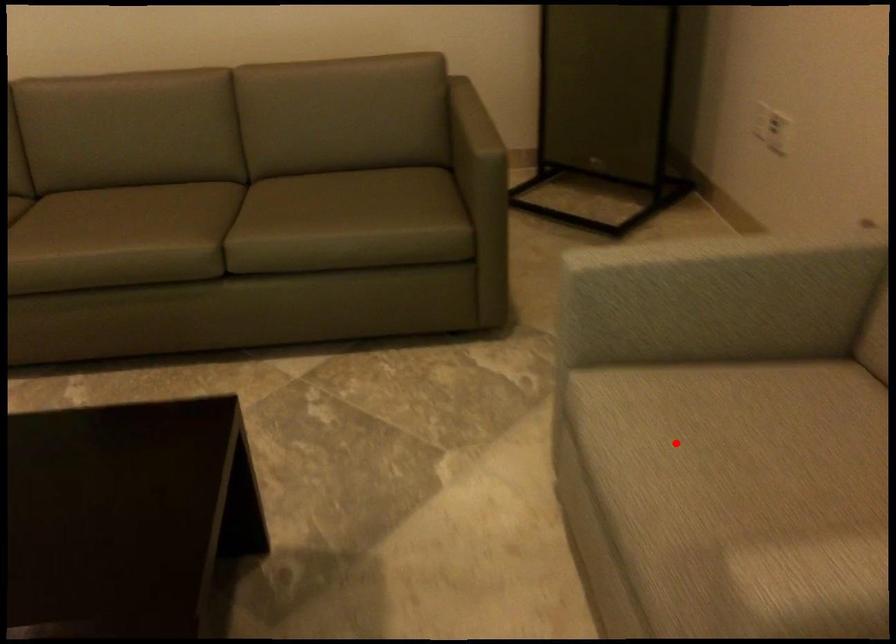
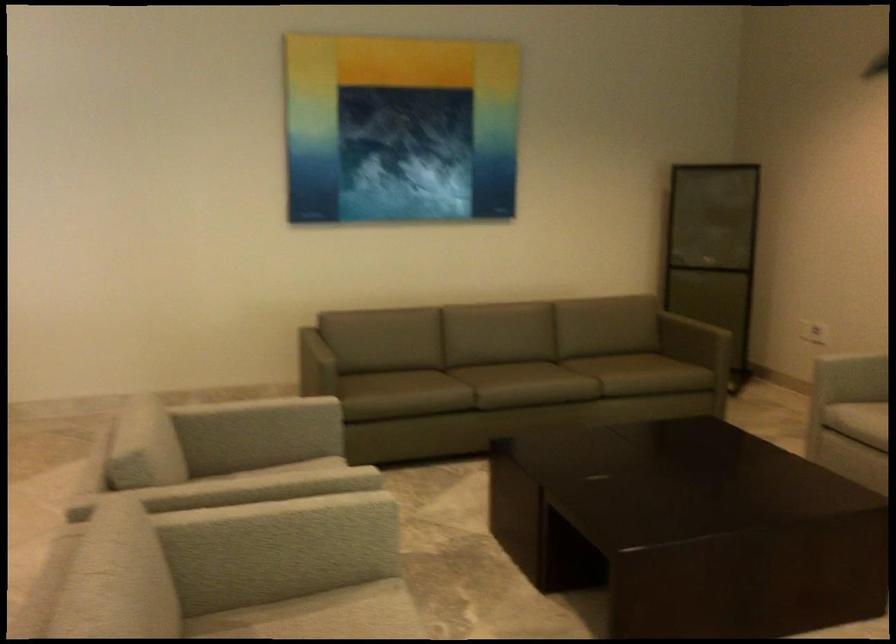
In the second image, find the point that corresponds to the highlighted location in the first image.

(857, 420)